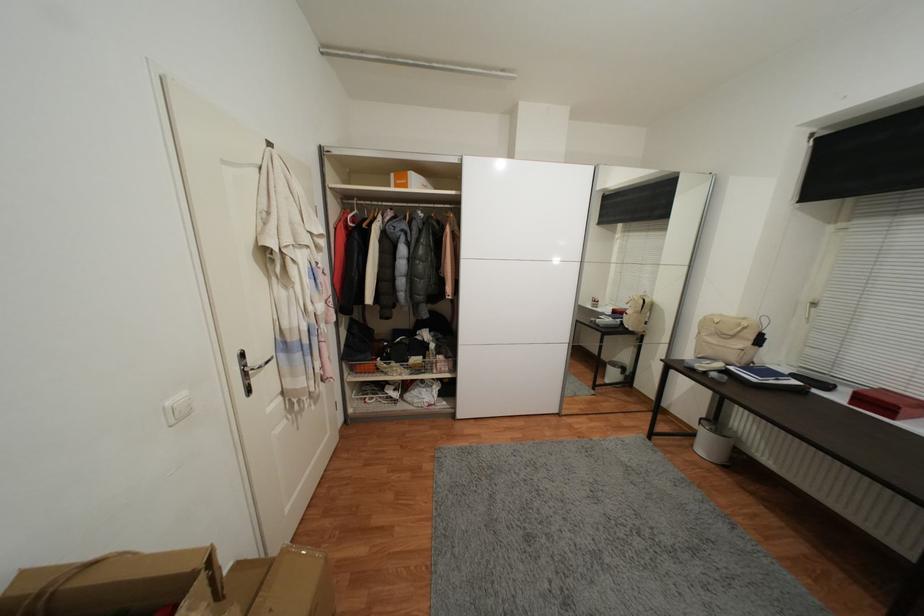
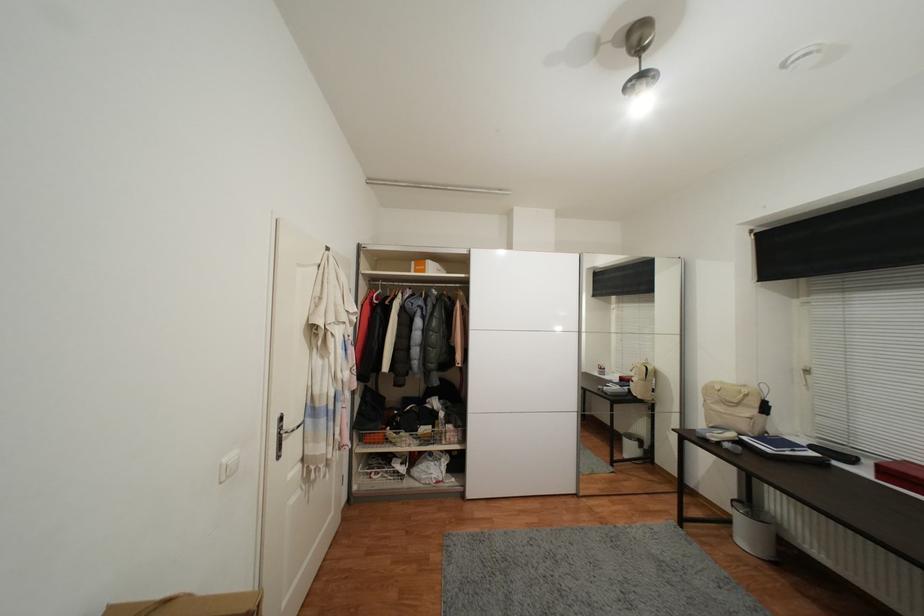
Question: What movement of the cameraman would produce the second image?

Choices:
 (A) Left
 (B) Right
 (C) Forward
 (D) Backward

Answer: (D)